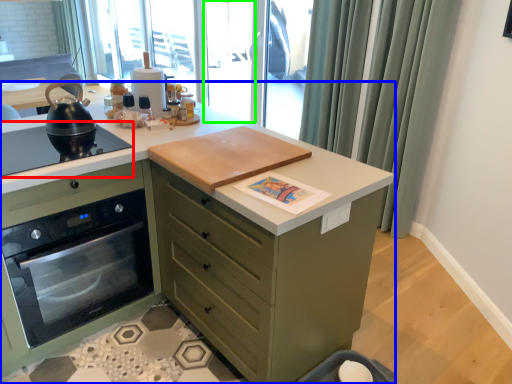
Question: Considering the real-world distances, which object is farthest from gas stove (highlighted by a red box)? countertop (highlighted by a blue box) or screen door (highlighted by a green box)?

Choices:
 (A) countertop
 (B) screen door

Answer: (B)